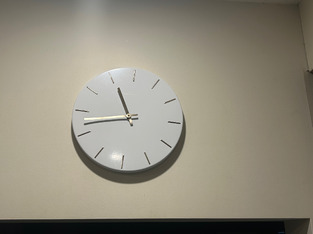
At what (x,y) coordinates should I click in order to perform the action: click on light. Please return your answer as a coordinate pair (x, y). The image size is (313, 234). Looking at the image, I should click on (92, 20).